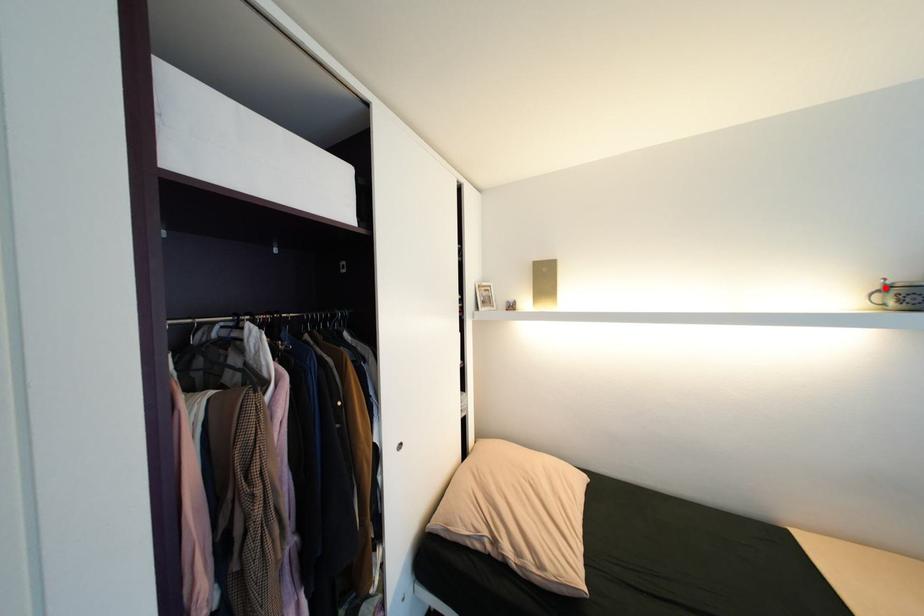
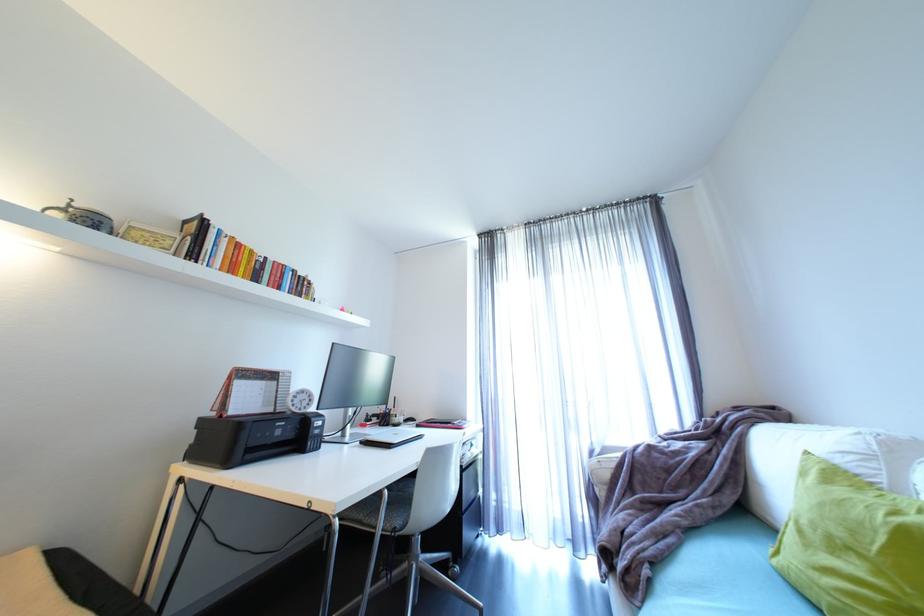
Locate, in the second image, the point that corresponds to the highlighted location in the first image.

(69, 206)